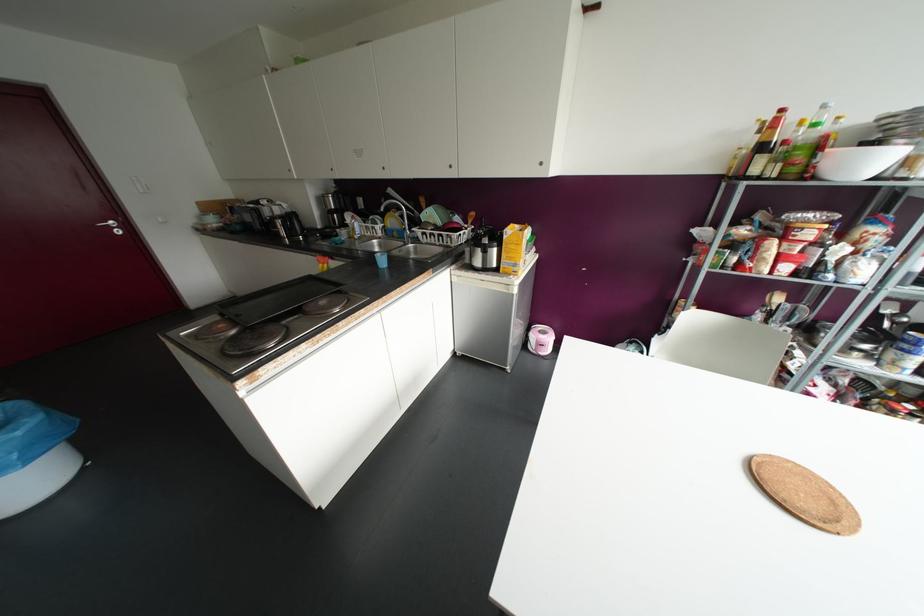
What do you see at coordinates (857, 161) in the screenshot?
I see `a white ceramic bowl` at bounding box center [857, 161].